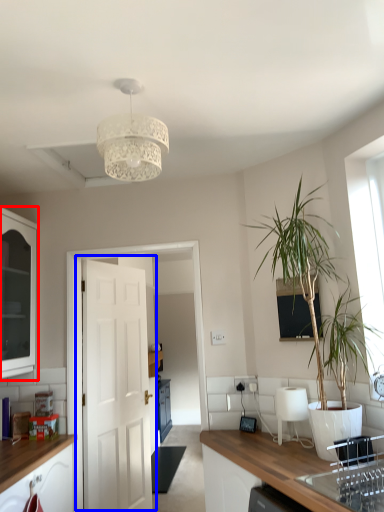
Question: Which of the following is the closest to the observer, cabinetry (highlighted by a red box) or door (highlighted by a blue box)?

Choices:
 (A) cabinetry
 (B) door

Answer: (A)